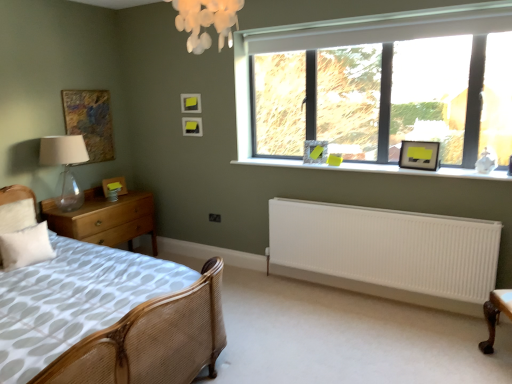
Question: Is matte black picture frame at upper right, positioned as the first picture frame in right-to-left order, inside matte black picture frame at upper right, the 5th picture frame when ordered from left to right?

Choices:
 (A) no
 (B) yes

Answer: (A)

Question: Is matte black picture frame at upper right, placed as the second picture frame when sorted from right to left, thinner than matte black picture frame at upper right, positioned as the first picture frame in right-to-left order?

Choices:
 (A) no
 (B) yes

Answer: (A)

Question: Is matte black picture frame at upper right, placed as the second picture frame when sorted from right to left, shorter than matte black picture frame at upper right, the sixth picture frame when ordered from left to right?

Choices:
 (A) no
 (B) yes

Answer: (B)

Question: Is matte black picture frame at upper right, the 5th picture frame when ordered from left to right, taller than matte black picture frame at upper right, the sixth picture frame when ordered from left to right?

Choices:
 (A) yes
 (B) no

Answer: (B)

Question: From a real-world perspective, is matte black picture frame at upper right, placed as the second picture frame when sorted from right to left, beneath matte black picture frame at upper right, positioned as the first picture frame in right-to-left order?

Choices:
 (A) no
 (B) yes

Answer: (B)

Question: From a real-world perspective, is matte black picture frame at upper right, the sixth picture frame when ordered from left to right, positioned above or below matte black picture frame at upper right, the 5th picture frame when ordered from left to right?

Choices:
 (A) above
 (B) below

Answer: (A)

Question: Would you say matte black picture frame at upper right, positioned as the first picture frame in right-to-left order, is inside or outside matte black picture frame at upper right, the 5th picture frame when ordered from left to right?

Choices:
 (A) outside
 (B) inside

Answer: (A)

Question: Considering the positions of point (433, 163) and point (324, 142), is point (433, 163) closer or farther from the camera than point (324, 142)?

Choices:
 (A) farther
 (B) closer

Answer: (B)

Question: Based on their positions, is matte black picture frame at upper right, positioned as the first picture frame in right-to-left order, located to the left or right of matte black picture frame at upper right, the 5th picture frame when ordered from left to right?

Choices:
 (A) left
 (B) right

Answer: (B)

Question: Would you say white smooth window sill at center is to the left or to the right of transparent glass table lamp at left in the picture?

Choices:
 (A) left
 (B) right

Answer: (B)

Question: Do you think white smooth window sill at center is within transparent glass table lamp at left, or outside of it?

Choices:
 (A) inside
 (B) outside

Answer: (B)

Question: Is point (249, 163) closer or farther from the camera than point (54, 157)?

Choices:
 (A) closer
 (B) farther

Answer: (B)

Question: In terms of width, does white smooth window sill at center look wider or thinner when compared to transparent glass table lamp at left?

Choices:
 (A) thin
 (B) wide

Answer: (A)

Question: Is point (31, 233) positioned closer to the camera than point (245, 158)?

Choices:
 (A) farther
 (B) closer

Answer: (B)

Question: From the image's perspective, is white soft pillow at lower left positioned above or below white smooth window sill at center?

Choices:
 (A) above
 (B) below

Answer: (B)